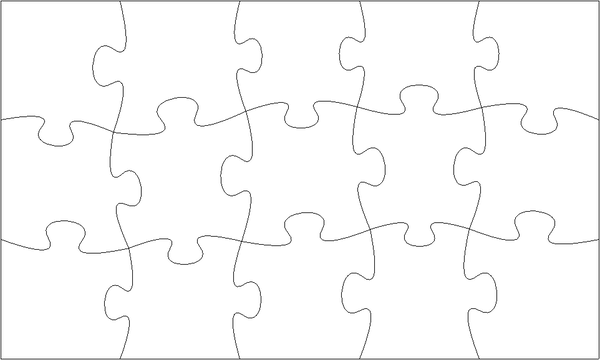
Where is `corner pieces`? corner pieces is located at coordinates (51, 52), (563, 60), (543, 319), (42, 305).